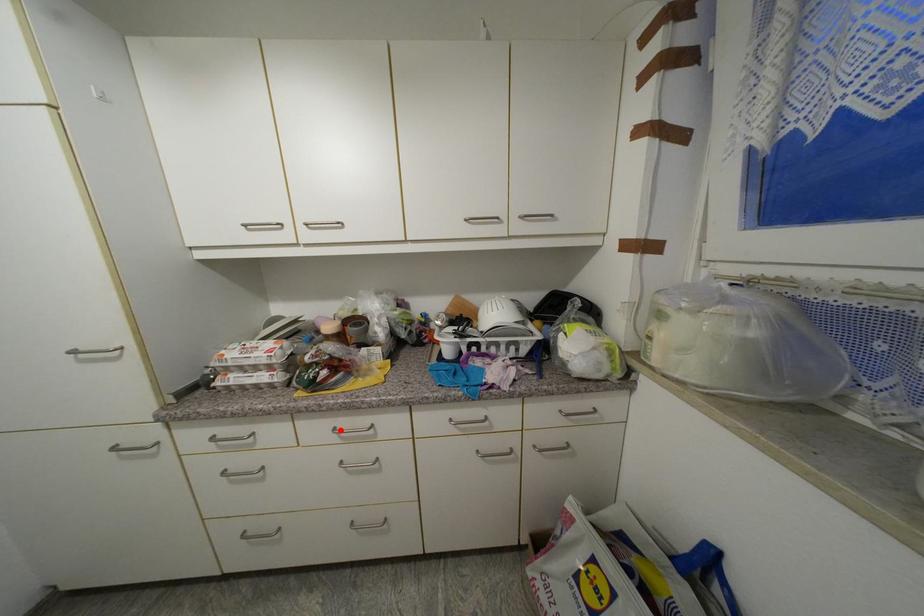
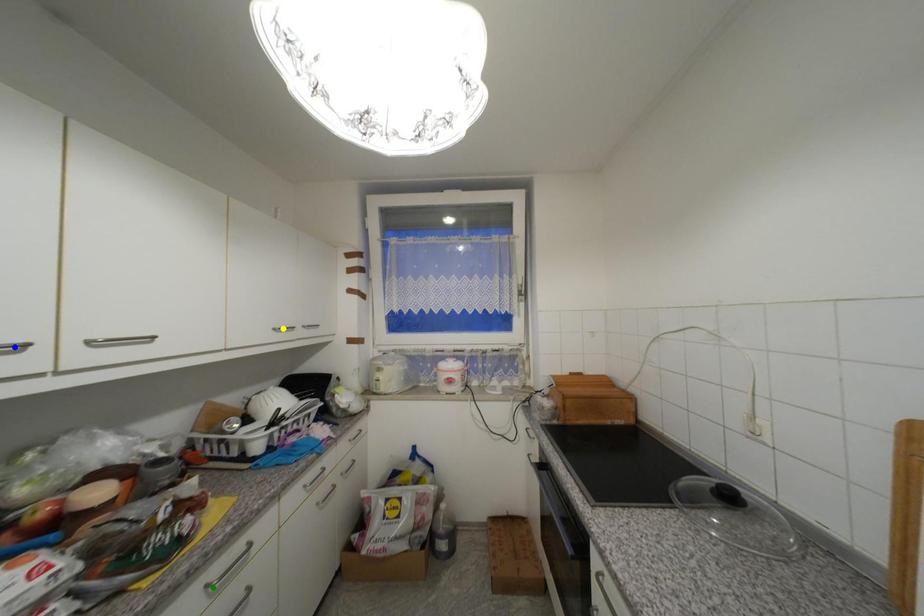
Question: I am providing you with two images of the same scene from different viewpoints. A red point is marked on the first image. You are given multiple points on the second image. Can you choose the point in image 2 that corresponds to the point in image 1?

Choices:
 (A) yellow point
 (B) green point
 (C) blue point

Answer: (B)